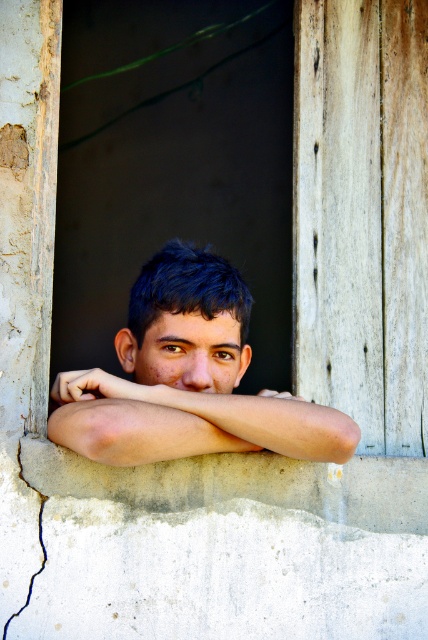
Question: Is smooth skin face at center further to the viewer compared to smooth skin arm at center?

Choices:
 (A) yes
 (B) no

Answer: (A)

Question: Can you confirm if smooth skin face at center is bigger than smooth skin arm at center?

Choices:
 (A) yes
 (B) no

Answer: (A)

Question: Which of the following is the farthest from the observer?

Choices:
 (A) (202, 264)
 (B) (148, 416)

Answer: (A)

Question: Where is smooth skin face at center located in relation to smooth skin arm at center in the image?

Choices:
 (A) above
 (B) below

Answer: (A)